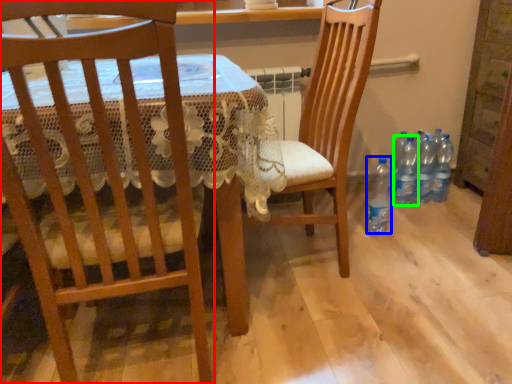
Question: Estimate the real-world distances between objects in this image. Which object is closer to chair (highlighted by a red box), bottle (highlighted by a blue box) or bottle (highlighted by a green box)?

Choices:
 (A) bottle
 (B) bottle

Answer: (A)